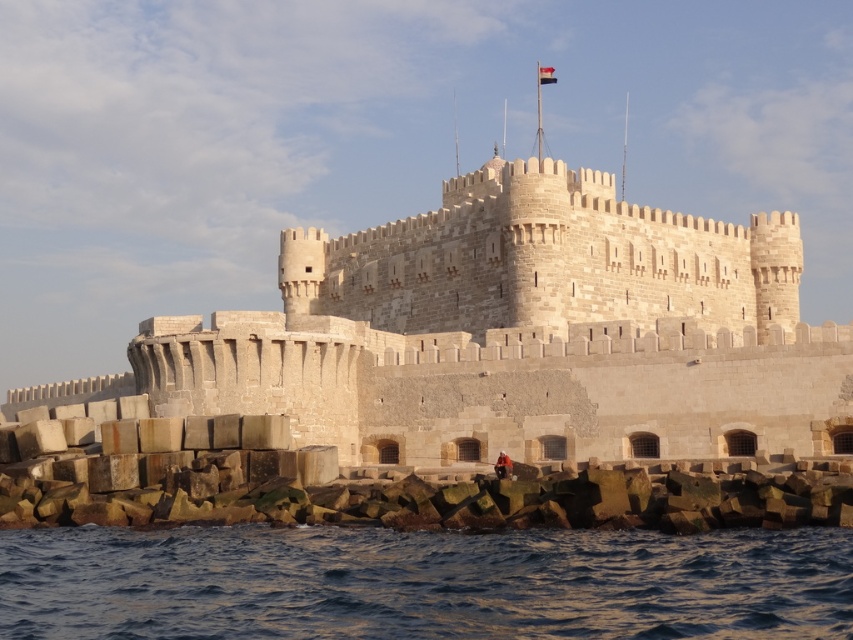
You are a GUI agent. You are given a task and a screenshot of the screen. Output one action in this format:
    pyautogui.click(x=<x>, y=<y>)
    Task: Click on the beige stone castle at center
    
    Given the screenshot: What is the action you would take?
    pyautogui.click(x=514, y=336)

Is point (216, 364) more distant than point (106, 563)?

Yes, point (216, 364) is farther from viewer.

Find the location of `beige stone castle at center`. beige stone castle at center is located at coordinates (514, 336).